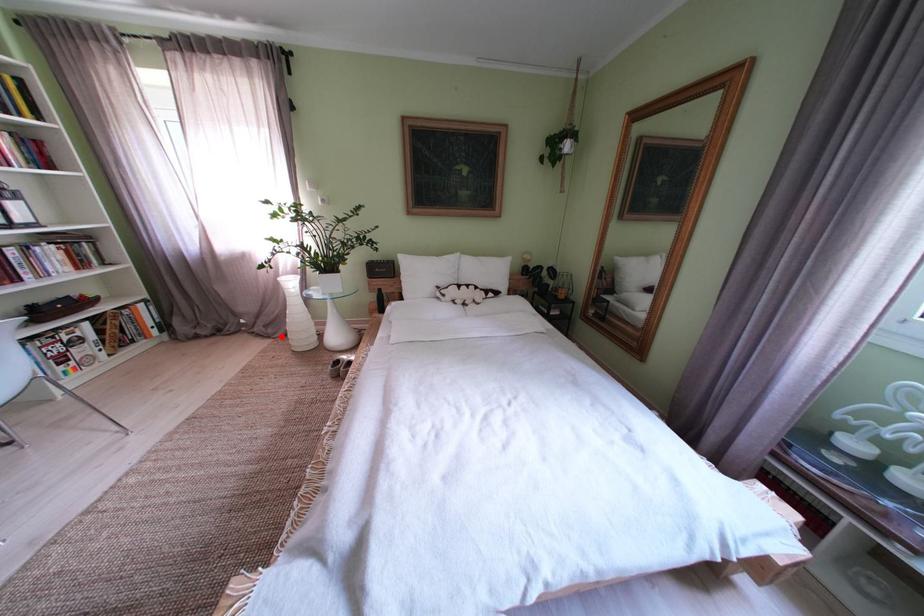
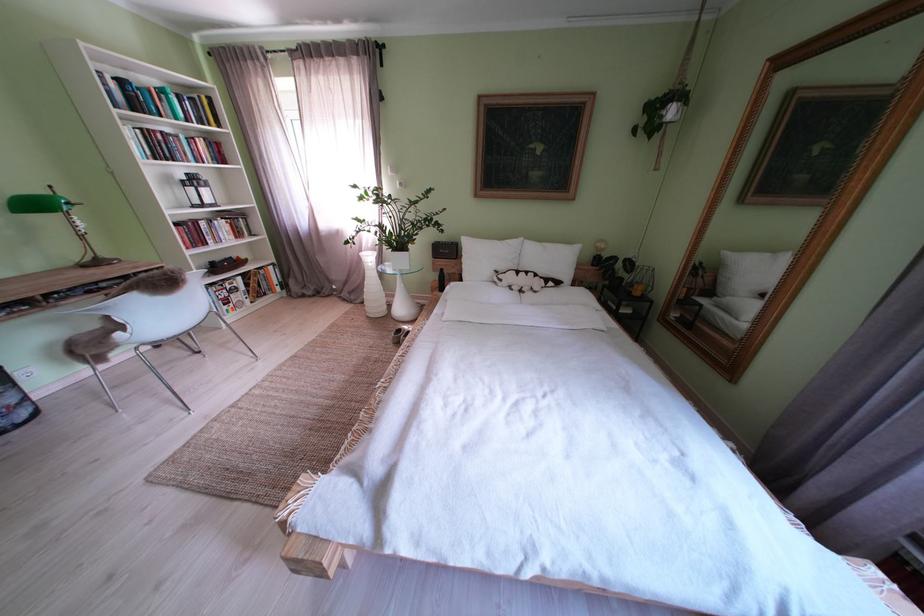
Find the pixel in the second image that matches the highlighted location in the first image.

(363, 302)